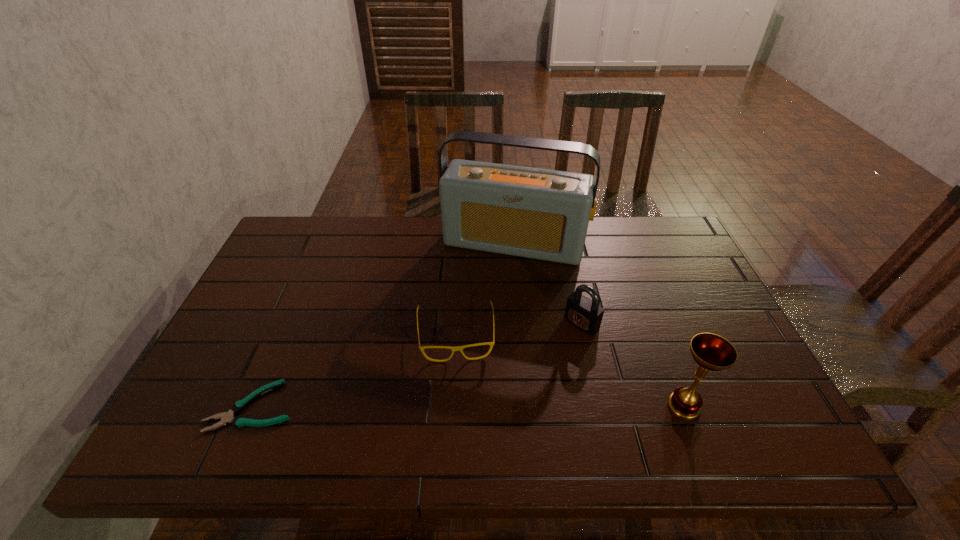
This screenshot has height=540, width=960. Find the location of `vacant space at the far left corner of the desktop`. vacant space at the far left corner of the desktop is located at coordinates (299, 251).

In the image, there is a desktop. At what (x,y) coordinates should I click in order to perform the action: click on vacant space at the near left corner. Please return your answer as a coordinate pair (x, y). Looking at the image, I should click on (246, 384).

Where is `vacant area that lies between the radio receiver and the leftmost object`? The image size is (960, 540). vacant area that lies between the radio receiver and the leftmost object is located at coordinates (383, 325).

The width and height of the screenshot is (960, 540). I want to click on free area in between the farthest object and the third shortest object, so click(547, 283).

Locate an element on the screen. The height and width of the screenshot is (540, 960). vacant space in between the spectacles and the shortest object is located at coordinates (354, 370).

Locate an element on the screen. This screenshot has height=540, width=960. empty space between the chalice and the spectacles is located at coordinates (569, 370).

Identify the location of free space between the padlock and the farthest object. (547, 283).

The height and width of the screenshot is (540, 960). I want to click on unoccupied area between the tallest object and the pliers, so click(383, 325).

You are a GUI agent. You are given a task and a screenshot of the screen. Output one action in this format:
    pyautogui.click(x=<x>, y=<y>)
    Task: Click on the vacant space that is in between the farthest object and the spectacles
    Image resolution: width=960 pixels, height=540 pixels.
    Given the screenshot: What is the action you would take?
    pyautogui.click(x=485, y=289)

What are the coordinates of `free area in between the padlock and the pliers` in the screenshot? It's located at (417, 364).